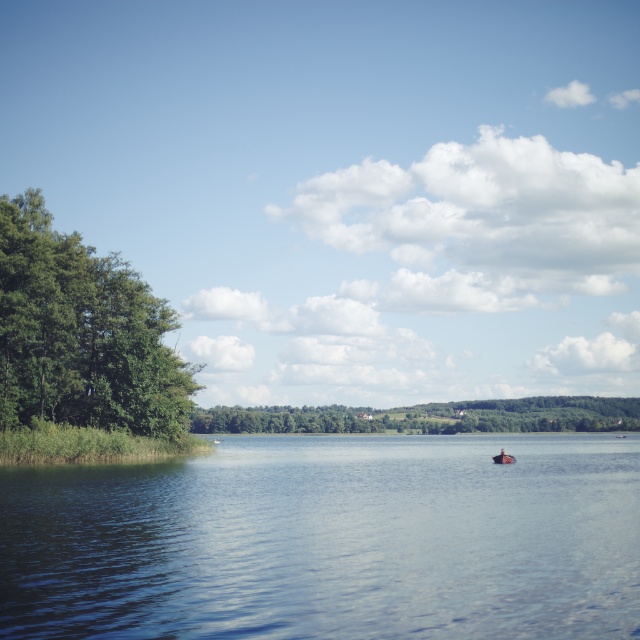
You are an environmental scientist studying the lake. You observe the blue smooth water at center and the green leafy trees at center. Which object occupies a larger area in the scene?

The green leafy trees at center occupy a larger area in the scene compared to the blue smooth water at center, as the water has a smaller size.

Looking at this image, you are standing on the lakeside and want to take a photo of the blue smooth water at center and the wooden boat at center. Which object should you focus on first if you want to capture both in the same frame without moving your camera?

The blue smooth water at center is larger in size than the wooden boat at center, so you should focus on the blue smooth water at center first to ensure it fits within the frame before adjusting for the smaller wooden boat at center.

You are a photographer planning to capture the wooden boat at center in the foreground while keeping the green leafy trees at center in the background. Which object should you focus on to ensure the boat is sharp and the trees are slightly blurred?

To ensure the wooden boat at center is sharp and the green leafy trees at center are slightly blurred, focus on the wooden boat at center. Since the green leafy trees at center are larger, they are likely farther away, creating a depth of field where the closer object remains in focus while the background becomes softer.